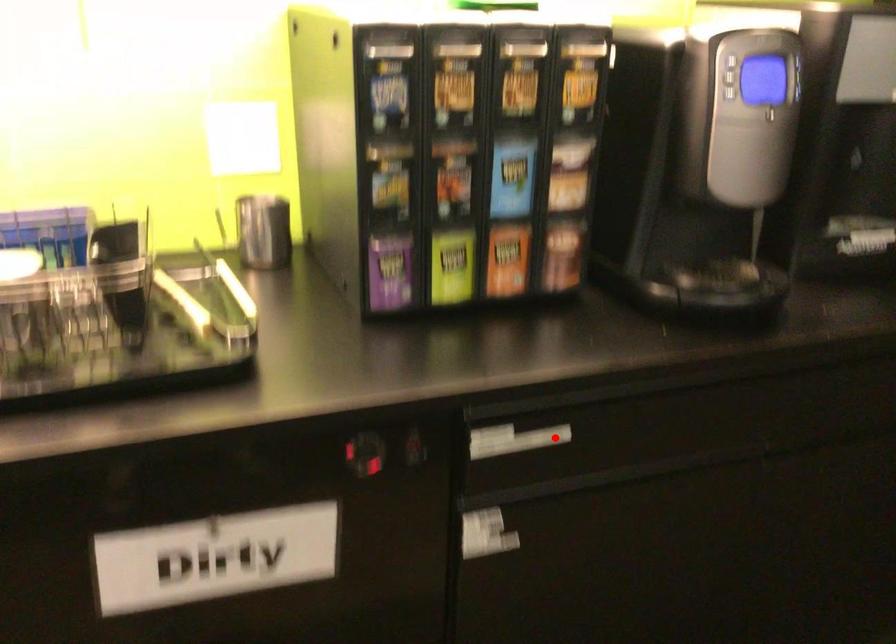
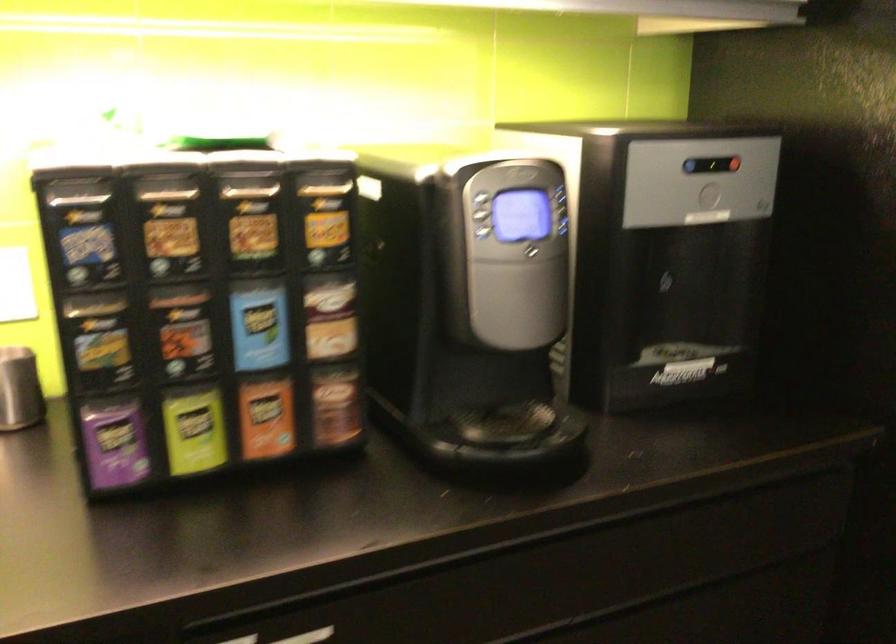
Where in the second image is the point corresponding to the highlighted location from the first image?

(308, 636)